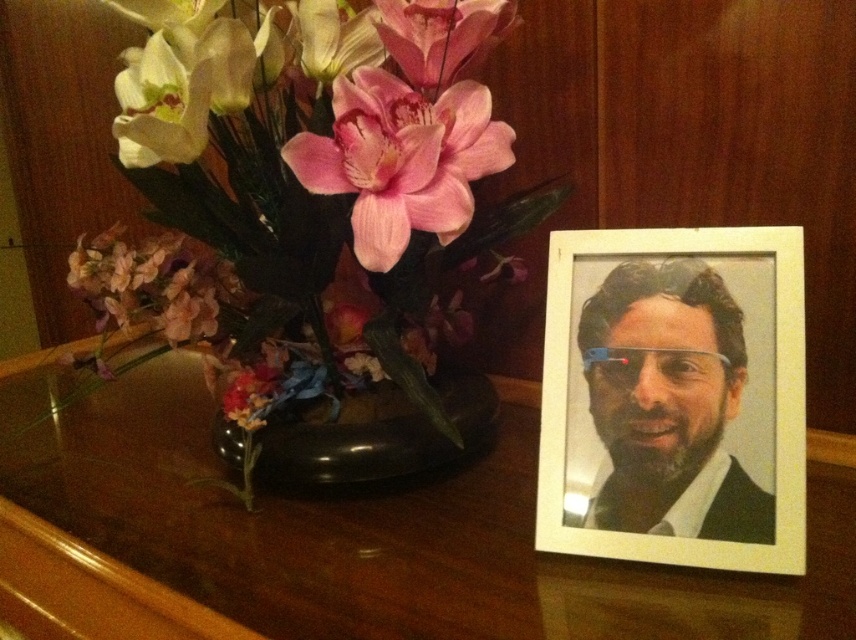
You are standing at the point marked by the coordinate point at point (822, 529). You want to place a 10 inch wide book between the artificial flowers in the black vase and the framed photograph. Can you fit it there?

The distance between the artificial flowers in the black vase and the framed photograph is 20.79 inches. Since the book is 10 inches wide, it can fit between them as there is enough space.

You are looking at the wooden surface with the floral arrangement and the framed photograph. There are two points marked on the image at coordinates point (429, 264) and point (357, 168). From your perspective, which point is closer to you?

Point (357, 168) is closer to you because it is less further to the camera than point (429, 264).

You are arranging a centerpiece for a small event and need to know the height of the flowers. Which of the two flowers, the silky artificial flowers at left or the pink matte flower at center, is taller?

The silky artificial flowers at left is taller than the pink matte flower at center.